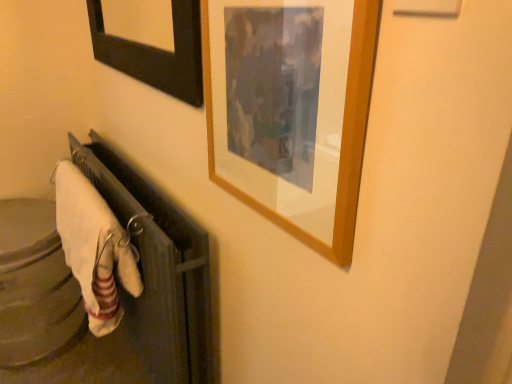
Question: From the image's perspective, is wooden picture frame at upper right under white soft towel at lower left?

Choices:
 (A) no
 (B) yes

Answer: (A)

Question: Is wooden picture frame at upper right next to white soft towel at lower left?

Choices:
 (A) no
 (B) yes

Answer: (A)

Question: Is wooden picture frame at upper right bigger than white soft towel at lower left?

Choices:
 (A) yes
 (B) no

Answer: (B)

Question: Is wooden picture frame at upper right wider than white soft towel at lower left?

Choices:
 (A) no
 (B) yes

Answer: (A)

Question: Is wooden picture frame at upper right aimed at white soft towel at lower left?

Choices:
 (A) no
 (B) yes

Answer: (A)

Question: Is wooden picture frame at upper right looking in the opposite direction of white soft towel at lower left?

Choices:
 (A) no
 (B) yes

Answer: (A)

Question: From the image's perspective, does white soft towel at lower left appear higher than wooden picture frame at upper right?

Choices:
 (A) no
 (B) yes

Answer: (A)

Question: From a real-world perspective, is white soft towel at lower left beneath wooden picture frame at upper right?

Choices:
 (A) yes
 (B) no

Answer: (A)

Question: Is white soft towel at lower left positioned far away from wooden picture frame at upper right?

Choices:
 (A) yes
 (B) no

Answer: (B)

Question: Is white soft towel at lower left to the left of wooden picture frame at upper right from the viewer's perspective?

Choices:
 (A) yes
 (B) no

Answer: (A)

Question: From a real-world perspective, is white soft towel at lower left located higher than wooden picture frame at upper right?

Choices:
 (A) yes
 (B) no

Answer: (B)

Question: Is white soft towel at lower left aimed at wooden picture frame at upper right?

Choices:
 (A) yes
 (B) no

Answer: (B)

Question: From a real-world perspective, is white soft towel at lower left positioned above or below wooden picture frame at upper right?

Choices:
 (A) above
 (B) below

Answer: (B)